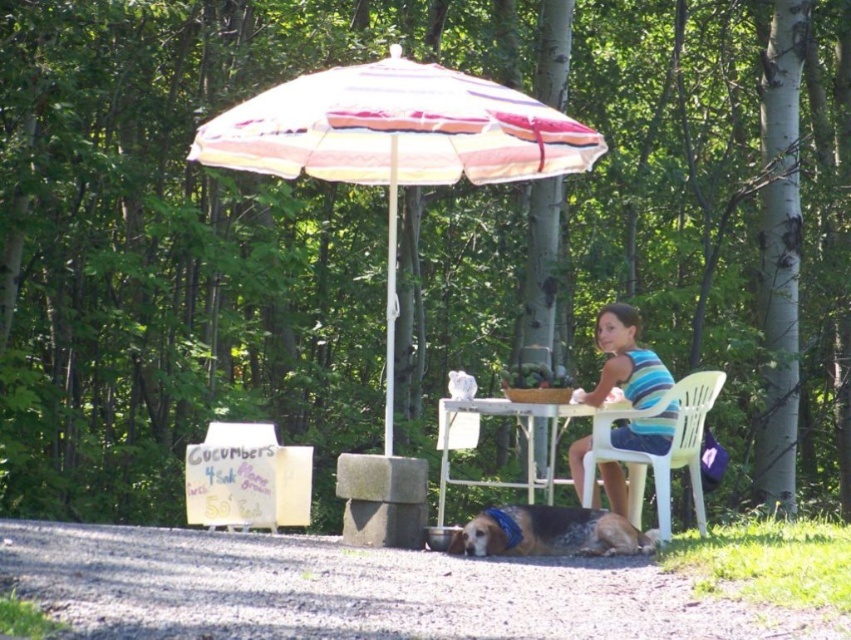
You are standing at the camera position and want to throw a ball to a friend who is at point (x=655, y=362). There is an obstacle at point (x=192, y=147). Will the ball pass over the obstacle?

Point (x=192, y=147) is closer to the camera than point (x=655, y=362), so the ball will hit the obstacle at point (x=192, y=147) before reaching your friend.